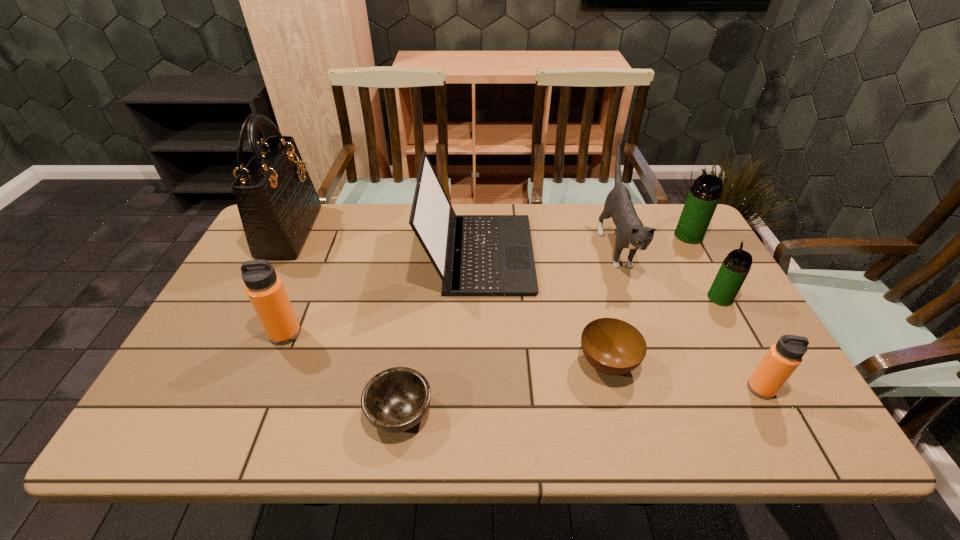
The height and width of the screenshot is (540, 960). Find the location of `free point located 0.240m from the spout of the farthest thermos bottle`. free point located 0.240m from the spout of the farthest thermos bottle is located at coordinates (600, 235).

What are the coordinates of `vacant space located from the spout of the farthest thermos bottle` in the screenshot? It's located at (618, 235).

In order to click on free space located on the back of the left orange thermos bottle in this screenshot , I will do `click(324, 241)`.

I want to click on free space located from the spout of the nearer green thermos bottle, so click(687, 239).

This screenshot has height=540, width=960. I want to click on vacant area situated 0.300m from the spout of the nearer green thermos bottle, so click(x=680, y=226).

This screenshot has width=960, height=540. I want to click on blank area located from the spout of the nearer green thermos bottle, so click(681, 227).

This screenshot has width=960, height=540. I want to click on vacant position located 0.170m on the left of the nearer orange thermos bottle, so click(673, 388).

Image resolution: width=960 pixels, height=540 pixels. Identify the location of vacant area situated 0.290m on the left of the taller bowl. (455, 363).

Where is `blank space located on the back of the shorter bowl`? This screenshot has width=960, height=540. blank space located on the back of the shorter bowl is located at coordinates (419, 284).

Identify the location of handbag at the far edge. The image size is (960, 540). (277, 202).